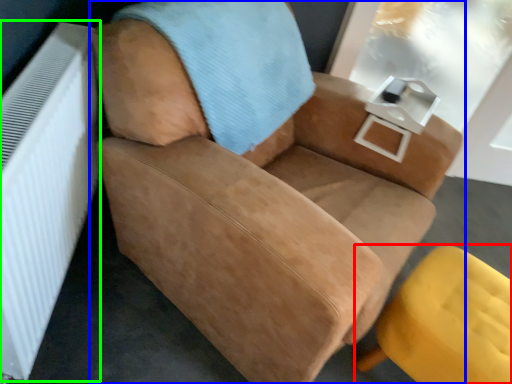
Question: Considering the real-world distances, which object is farthest from chair (highlighted by a red box)? chair (highlighted by a blue box) or radiator (highlighted by a green box)?

Choices:
 (A) chair
 (B) radiator

Answer: (B)